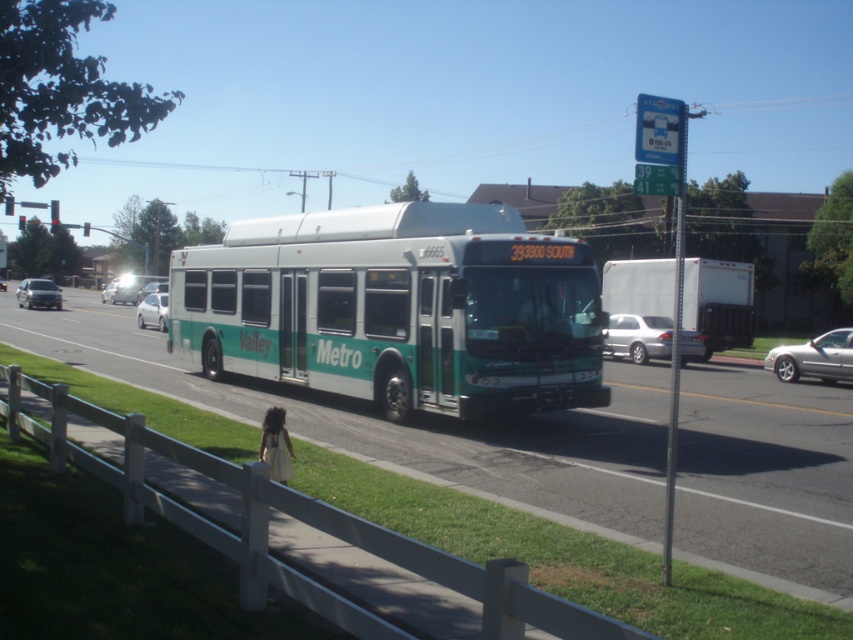
Is green matte bus at center below silver metallic sedan at left?

Indeed, green matte bus at center is positioned under silver metallic sedan at left.

What do you see at coordinates (398, 308) in the screenshot?
I see `green matte bus at center` at bounding box center [398, 308].

Does point (286, 278) come closer to viewer compared to point (47, 292)?

That is True.

I want to click on green matte bus at center, so click(x=398, y=308).

This screenshot has width=853, height=640. Describe the element at coordinates (398, 308) in the screenshot. I see `green matte bus at center` at that location.

Is point (419, 300) positioned in front of point (821, 355)?

Yes.

Where is `green matte bus at center`? green matte bus at center is located at coordinates (398, 308).

From the picture: Is white glossy sedan at left shorter than white glossy sedan at center?

Yes, white glossy sedan at left is shorter than white glossy sedan at center.

What do you see at coordinates (154, 310) in the screenshot? The height and width of the screenshot is (640, 853). I see `white glossy sedan at left` at bounding box center [154, 310].

You are a GUI agent. You are given a task and a screenshot of the screen. Output one action in this format:
    pyautogui.click(x=<x>, y=<y>)
    Task: Click on the white glossy sedan at left
    The width and height of the screenshot is (853, 640).
    Given the screenshot: What is the action you would take?
    pyautogui.click(x=154, y=310)